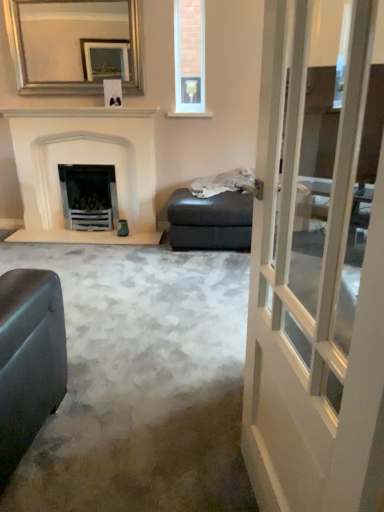
Question: From the image's perspective, would you say white glass door at center is shown under matte gray footrest at center?

Choices:
 (A) no
 (B) yes

Answer: (B)

Question: Considering the relative positions of white glass door at center and matte gray footrest at center in the image provided, is white glass door at center behind matte gray footrest at center?

Choices:
 (A) no
 (B) yes

Answer: (A)

Question: From a real-world perspective, is white glass door at center physically above matte gray footrest at center?

Choices:
 (A) no
 (B) yes

Answer: (B)

Question: Is matte gray footrest at center at the back of white glass door at center?

Choices:
 (A) yes
 (B) no

Answer: (B)

Question: Is white glass door at center located outside matte gray footrest at center?

Choices:
 (A) no
 (B) yes

Answer: (B)

Question: From their relative heights in the image, would you say clear glass wine glass at upper center is taller or shorter than white glass door at center?

Choices:
 (A) short
 (B) tall

Answer: (A)

Question: From the image's perspective, relative to white glass door at center, is clear glass wine glass at upper center above or below?

Choices:
 (A) above
 (B) below

Answer: (A)

Question: From a real-world perspective, is clear glass wine glass at upper center positioned above or below white glass door at center?

Choices:
 (A) above
 (B) below

Answer: (A)

Question: Does point (196, 50) appear closer or farther from the camera than point (334, 434)?

Choices:
 (A) farther
 (B) closer

Answer: (A)

Question: Is white glass door at center in front of or behind clear glass wine glass at upper center in the image?

Choices:
 (A) front
 (B) behind

Answer: (A)

Question: In the image, is white glass door at center on the left side or the right side of clear glass wine glass at upper center?

Choices:
 (A) right
 (B) left

Answer: (A)

Question: Is white glass door at center bigger or smaller than clear glass wine glass at upper center?

Choices:
 (A) small
 (B) big

Answer: (B)

Question: From the image's perspective, is white glass door at center above or below clear glass wine glass at upper center?

Choices:
 (A) below
 (B) above

Answer: (A)

Question: From the image's perspective, relative to clear glass wine glass at upper center, is silver metallic mirror at upper center above or below?

Choices:
 (A) above
 (B) below

Answer: (B)

Question: Considering their positions, is silver metallic mirror at upper center located in front of or behind clear glass wine glass at upper center?

Choices:
 (A) behind
 (B) front

Answer: (B)